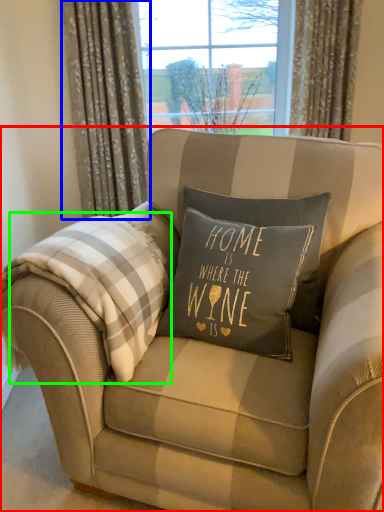
Question: Which is nearer to the chair (highlighted by a red box)? curtain (highlighted by a blue box) or flannel (highlighted by a green box).

Choices:
 (A) curtain
 (B) flannel

Answer: (B)